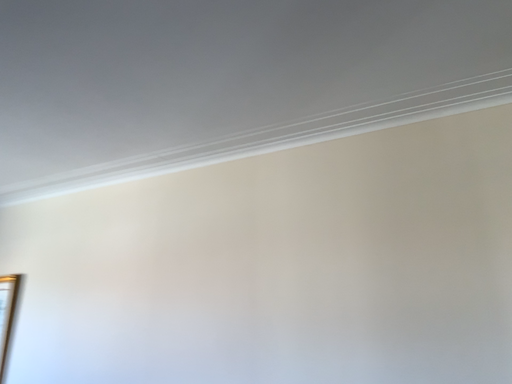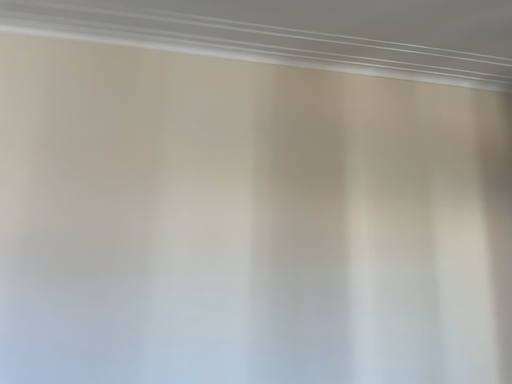
Question: Which way did the camera rotate in the video?

Choices:
 (A) rotated downward
 (B) rotated upward

Answer: (A)